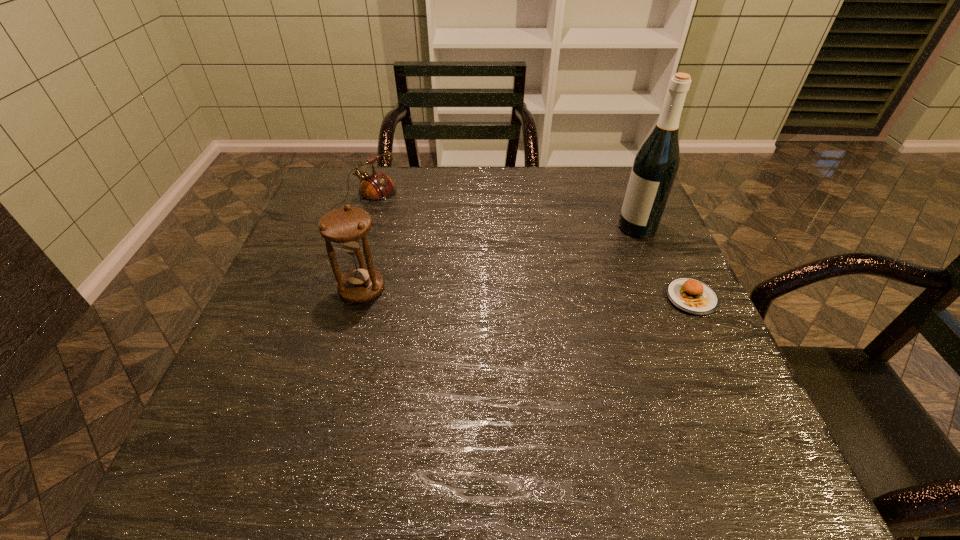
At what (x,y) coordinates should I click in order to perform the action: click on vacant space on the desktop that is between the hourglass and the shortest object and is positioned on the label of the tallest object. Please return your answer as a coordinate pair (x, y). Image resolution: width=960 pixels, height=540 pixels. Looking at the image, I should click on (510, 293).

At what (x,y) coordinates should I click in order to perform the action: click on free space on the desktop that is between the third shortest object and the shortest object and is positioned on the rotary dial of the telephone. Please return your answer as a coordinate pair (x, y). Looking at the image, I should click on (525, 294).